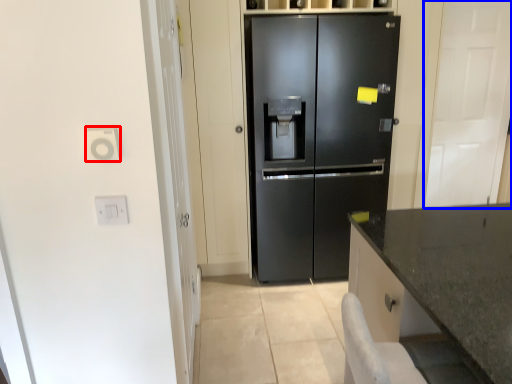
Question: Which object appears farthest to the camera in this image, electric outlet (highlighted by a red box) or glass door (highlighted by a blue box)?

Choices:
 (A) electric outlet
 (B) glass door

Answer: (B)